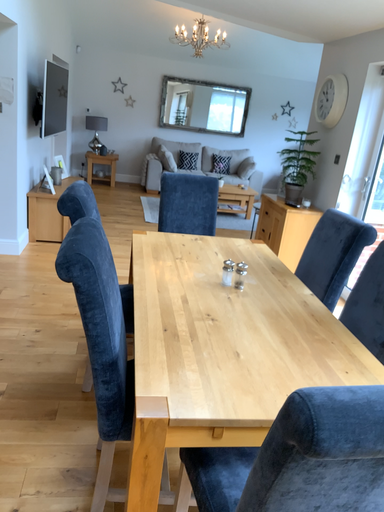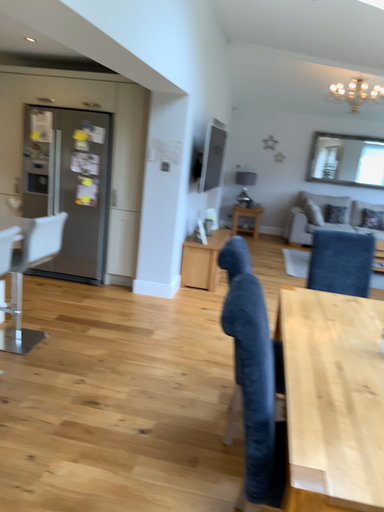
Question: Which way did the camera rotate in the video?

Choices:
 (A) rotated downward
 (B) rotated upward

Answer: (B)